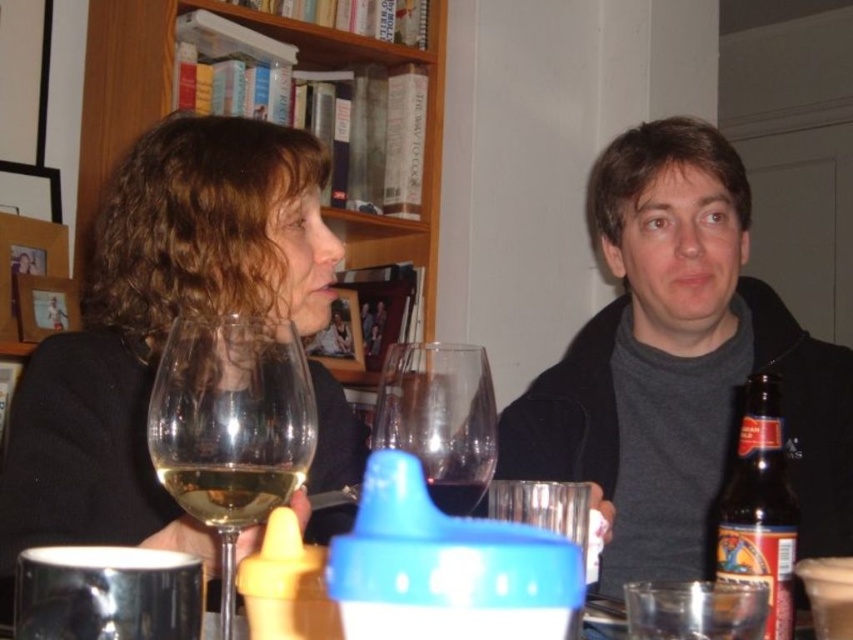
You are a bartender asked to serve drinks to two people at a table. You see the dark gray sweater at center and the translucent glass wine at center. Which item is bigger?

The dark gray sweater at center is larger than the translucent glass wine at center.

You are standing in front of the table where the two people are sitting. You want to reach the point at coordinates point (790, 621) without moving any objects on the table. Can you physically touch that point?

The point (790, 621) is 26.84 inches away from the viewer, so yes, you can physically touch that point without moving any objects on the table since it is within reach.

Where is the matte black sweater at upper left located in the image?

The matte black sweater at upper left is located at point (160,324) in the image.